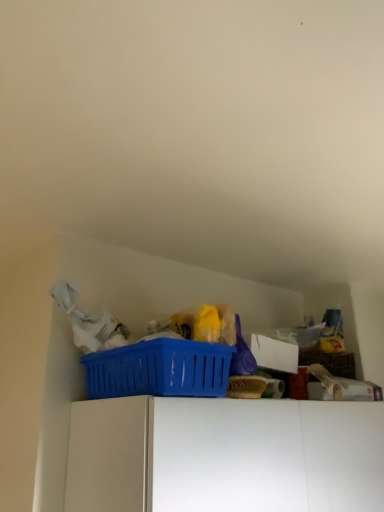
Question: Is white matte cabinet at upper center inside the boundaries of blue plastic basket at upper center, or outside?

Choices:
 (A) outside
 (B) inside

Answer: (A)

Question: Considering the positions of white matte cabinet at upper center and blue plastic basket at upper center in the image, is white matte cabinet at upper center bigger or smaller than blue plastic basket at upper center?

Choices:
 (A) small
 (B) big

Answer: (B)

Question: Visually, is white matte cabinet at upper center positioned to the left or to the right of blue plastic basket at upper center?

Choices:
 (A) right
 (B) left

Answer: (A)

Question: Is blue plastic basket at upper center taller or shorter than white matte cabinet at upper center?

Choices:
 (A) tall
 (B) short

Answer: (B)

Question: Considering the positions of blue plastic basket at upper center and white matte cabinet at upper center in the image, is blue plastic basket at upper center wider or thinner than white matte cabinet at upper center?

Choices:
 (A) wide
 (B) thin

Answer: (B)

Question: From the image's perspective, is blue plastic basket at upper center above or below white matte cabinet at upper center?

Choices:
 (A) above
 (B) below

Answer: (A)

Question: Is blue plastic basket at upper center in front of or behind white matte cabinet at upper center in the image?

Choices:
 (A) front
 (B) behind

Answer: (B)